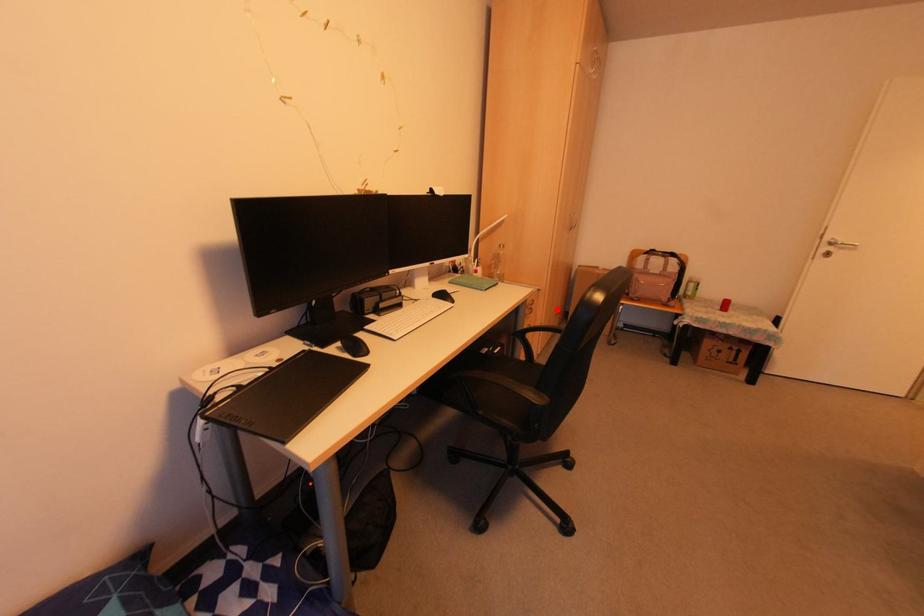
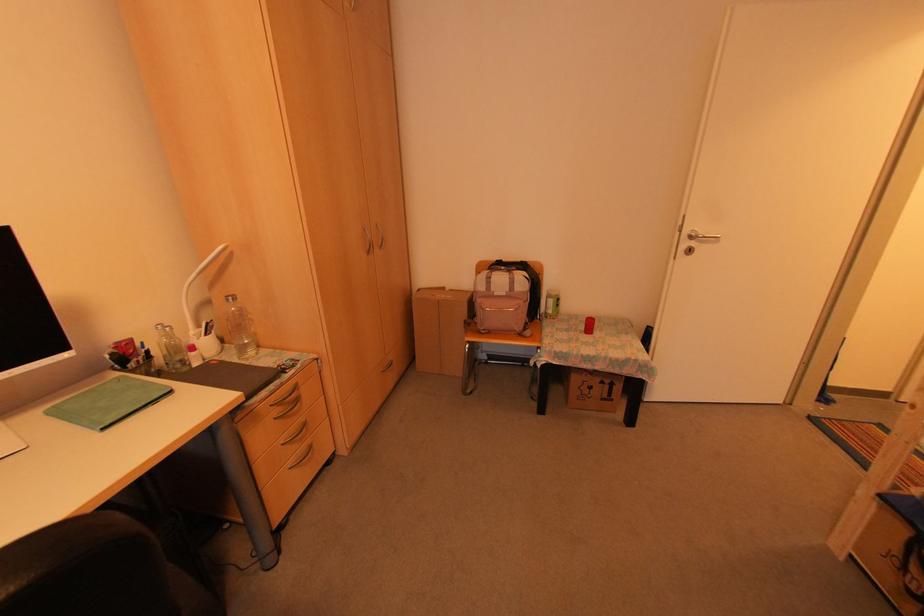
Question: A red point is marked in image1. In image2, is the corresponding 3D point closer to the camera or farther? Reply with the corresponding letter.

Choices:
 (A) The corresponding 3D point is closer.
 (B) The corresponding 3D point is farther.

Answer: (A)